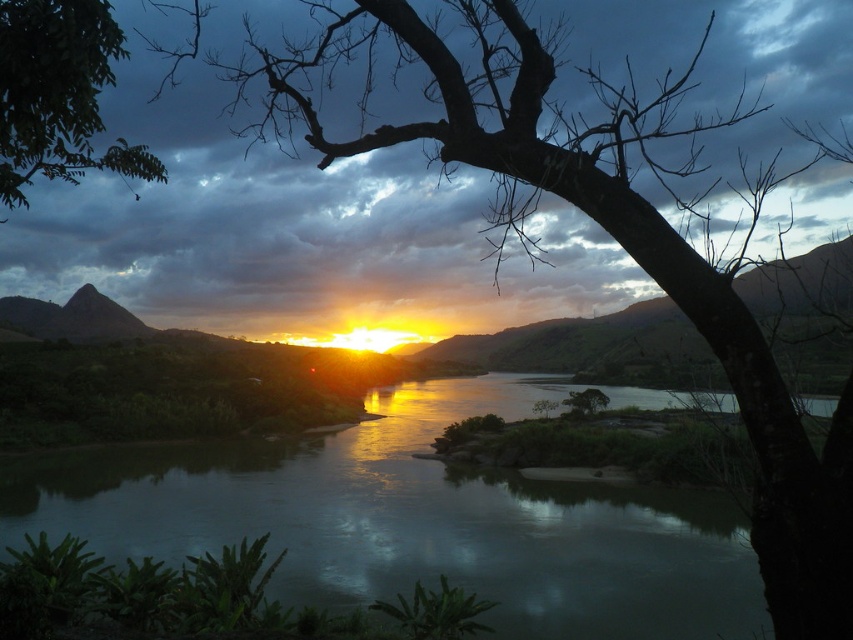
You are an artist trying to paint this sunset scene. You want to ensure the green leafy tree at upper left is proportionally smaller than the green reflective water at center in your painting. Based on the scene, is this accurate?

Yes, the green reflective water at center is much taller than the green leafy tree at upper left, so the tree should be painted proportionally smaller than the water in your painting.

Based on the photo, you are an artist planning to paint this sunset scene. You want to ensure the green reflective water at center and the green leafy tree at upper left are proportionally accurate. Which object should you paint larger?

The green reflective water at center should be painted larger than the green leafy tree at upper left because it is described as bigger in the scene.

You are an artist planning to paint the sunset scene. You want to ensure the green reflective water at center and the green leafy tree at upper left are proportionally accurate. Which object should you make wider in your painting?

The green reflective water at center should be made wider in the painting since its width is larger than the green leafy tree at upper left according to the description.